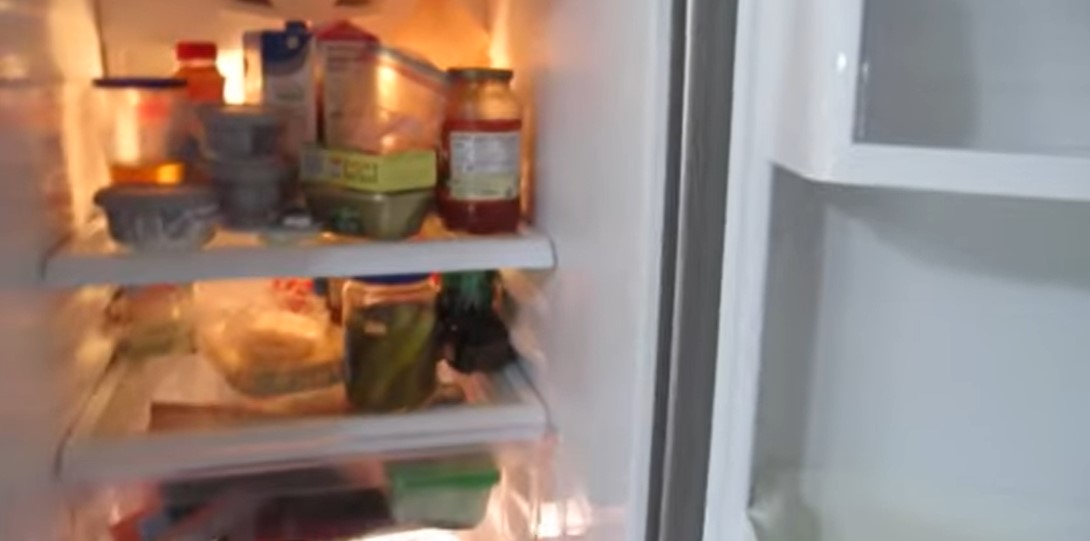
You are a GUI agent. You are given a task and a screenshot of the screen. Output one action in this format:
    pyautogui.click(x=<x>, y=<y>)
    Task: Click on the jar of red sauce
    This screenshot has width=1090, height=541.
    Given the screenshot: What is the action you would take?
    pyautogui.click(x=495, y=194)